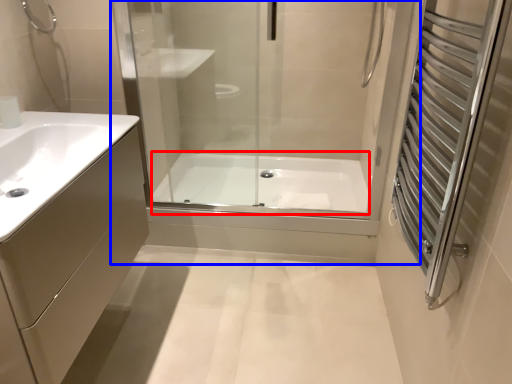
Question: Which point is further to the camera, bath (highlighted by a red box) or shower door (highlighted by a blue box)?

Choices:
 (A) bath
 (B) shower door

Answer: (A)